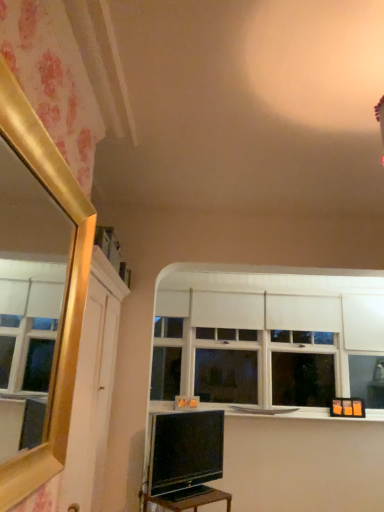
Question: Based on their sizes in the image, would you say white matte window at center is bigger or smaller than black glossy table at lower center?

Choices:
 (A) small
 (B) big

Answer: (B)

Question: From the image's perspective, is white matte window at center located above or below black glossy table at lower center?

Choices:
 (A) above
 (B) below

Answer: (A)

Question: Estimate the real-world distances between objects in this image. Which object is farther from the black glossy table at lower center?

Choices:
 (A) white matte window at center
 (B) white matte window sill at center
 (C) matte black tv at lower center

Answer: (A)

Question: Which of these objects is positioned closest to the black glossy table at lower center?

Choices:
 (A) matte black tv at lower center
 (B) white matte window at center
 (C) white matte window sill at center

Answer: (A)